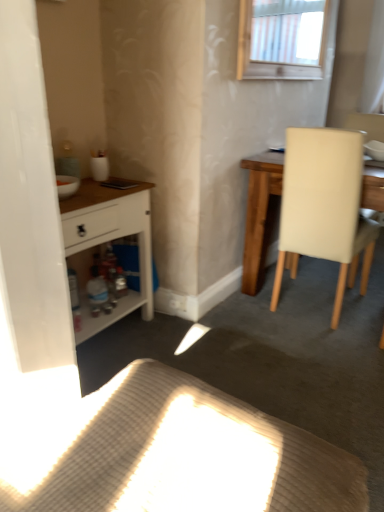
This screenshot has height=512, width=384. I want to click on blank space situated above woven fabric cushion at lower center (from a real-world perspective), so click(179, 446).